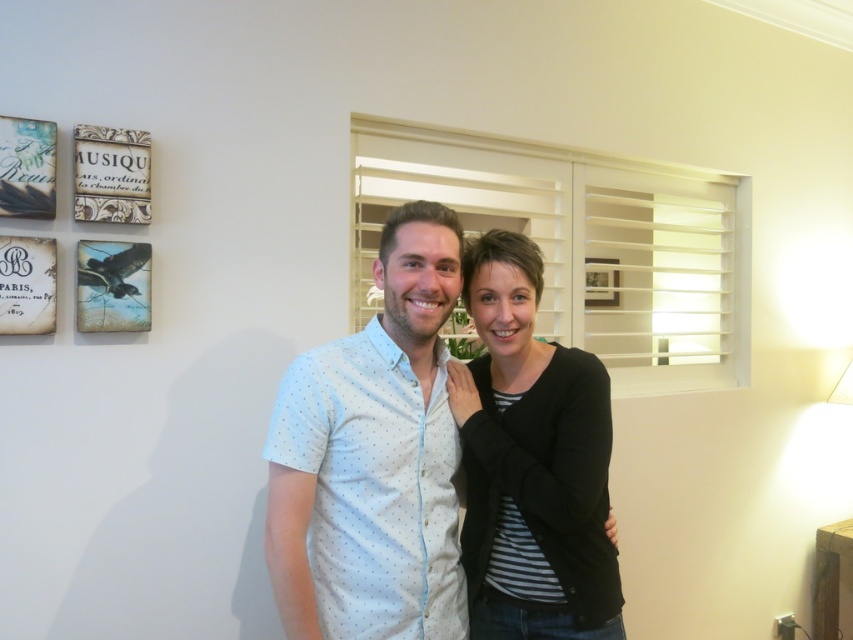
You are an interior designer analyzing the placement of objects in the image. The white dotted shirt at center is part of the scene. Can you determine its exact coordinates in the image?

The white dotted shirt at center is located at coordinates point (373, 458).

You are a photographer setting up a portrait for two people. The scene requires the person wearing the white dotted shirt at center to be framed slightly wider than the person in the black matte jacket at center. Can you confirm if this is possible based on their current positions?

The white dotted shirt at center might be wider than black matte jacket at center, so it is possible to frame the person wearing the white dotted shirt at center slightly wider than the person in the black matte jacket at center based on their current positions.